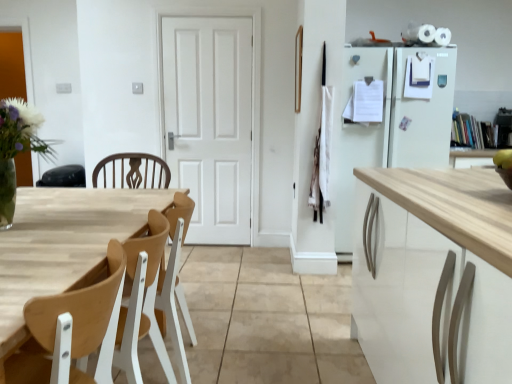
Question: From the image's perspective, is wooden at left located above or below wooden table at left?

Choices:
 (A) below
 (B) above

Answer: (B)

Question: From a real-world perspective, is wooden at left above or below wooden table at left?

Choices:
 (A) above
 (B) below

Answer: (A)

Question: Which object is positioned farthest from the white matte door at center?

Choices:
 (A) wooden table at left
 (B) clear glass vase at left
 (C) wooden at left

Answer: (C)

Question: Based on their relative distances, which object is nearer to the clear glass vase at left?

Choices:
 (A) wooden table at left
 (B) wooden at left
 (C) white matte door at center

Answer: (A)